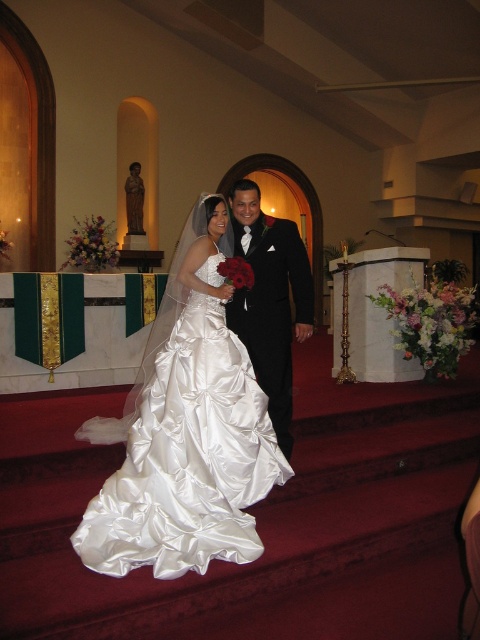
Can you confirm if satin dress at center is bigger than shiny black suit at center?

Indeed, satin dress at center has a larger size compared to shiny black suit at center.

Can you confirm if satin dress at center is positioned to the left of shiny black suit at center?

Yes, satin dress at center is to the left of shiny black suit at center.

Does point (167, 502) come closer to viewer compared to point (251, 314)?

Yes.

Identify the location of satin dress at center. The height and width of the screenshot is (640, 480). (186, 429).